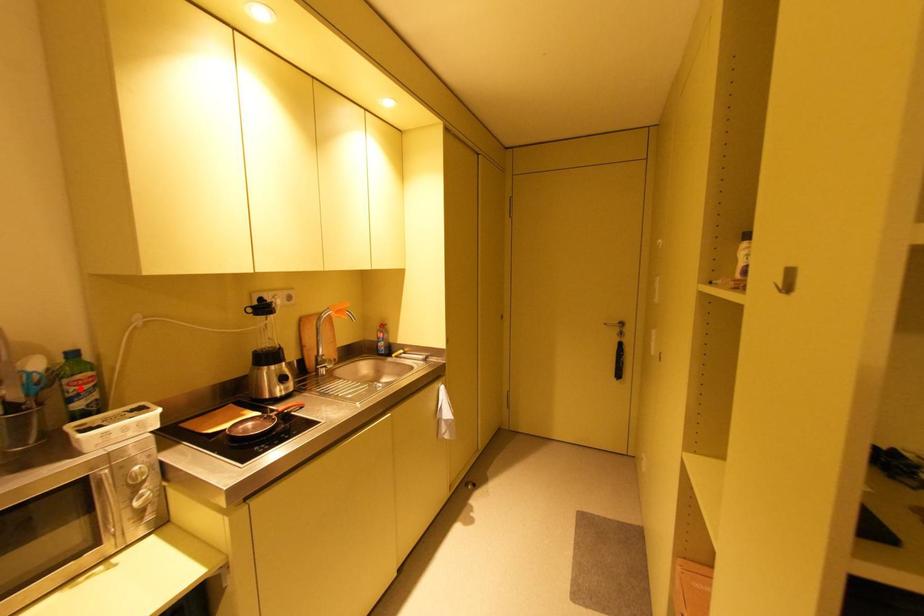
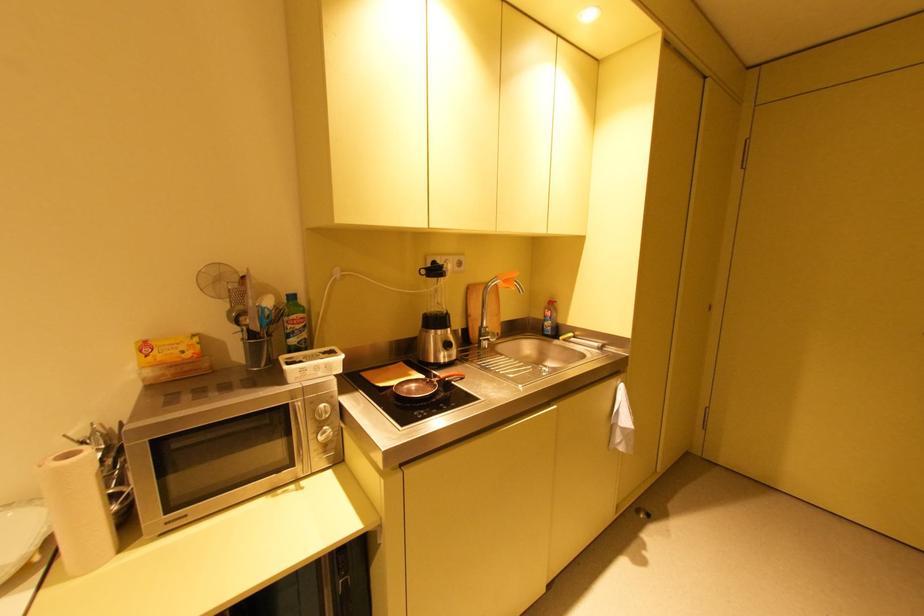
In the second image, find the point that corresponds to the highlighted location in the first image.

(296, 326)